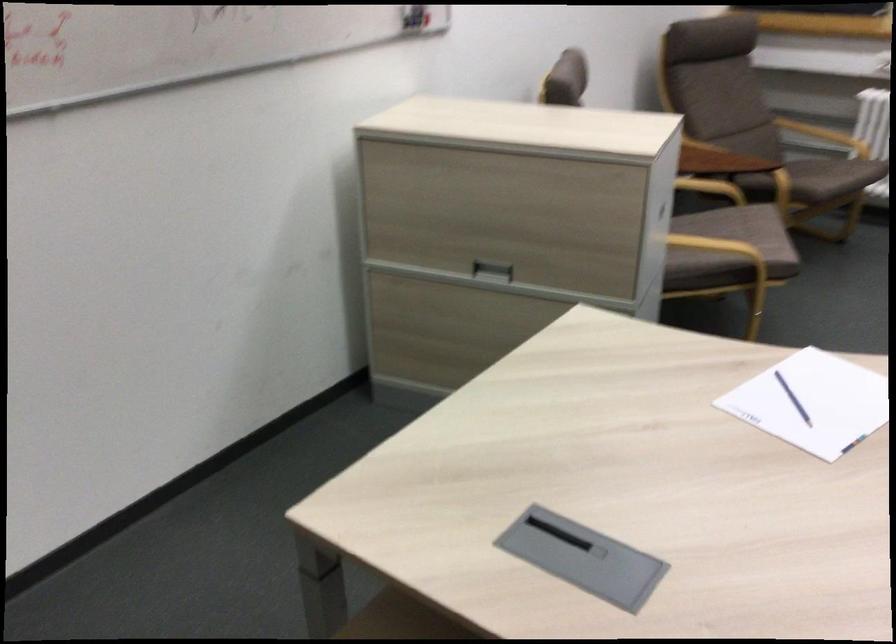
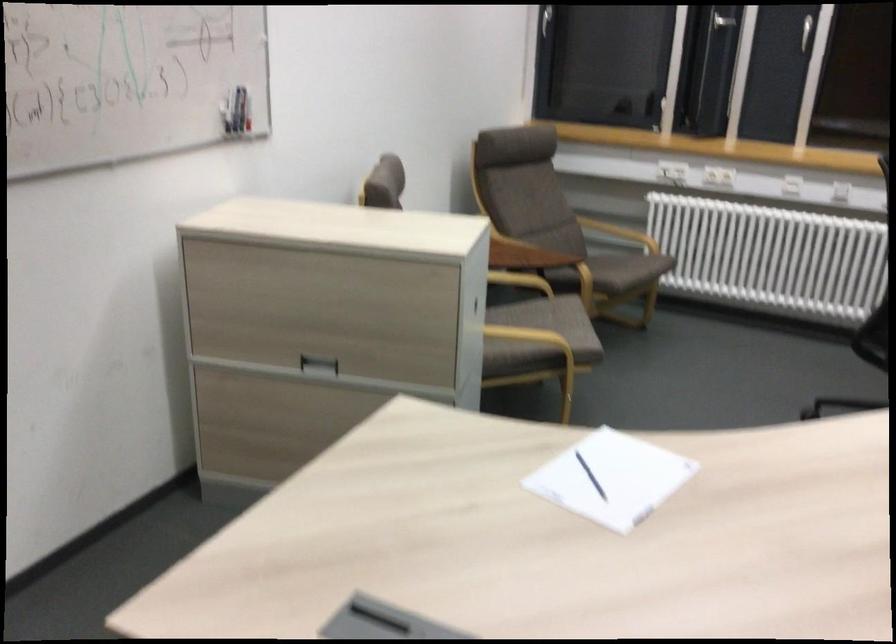
In the second image, find the point that corresponds to the point at 823,135 in the first image.

(619, 232)